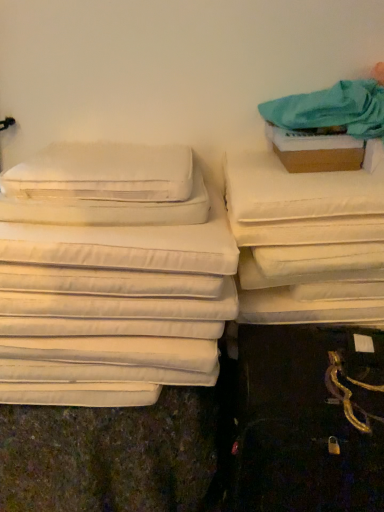
The height and width of the screenshot is (512, 384). What are the coordinates of `white soft pillow at left, the 1th pillow positioned from the bottom` in the screenshot? It's located at (108, 209).

The image size is (384, 512). What do you see at coordinates (298, 190) in the screenshot?
I see `white fabric cushion at upper right, the second sheet from the left` at bounding box center [298, 190].

The image size is (384, 512). Find the location of `white soft pillow at left, the 1th pillow positioned from the bottom`. white soft pillow at left, the 1th pillow positioned from the bottom is located at coordinates (108, 209).

Is teal fabric at upper right not close to brown cardboard box at upper right?

No, there isn't a large distance between teal fabric at upper right and brown cardboard box at upper right.

Which is correct: teal fabric at upper right is inside brown cardboard box at upper right, or outside of it?

teal fabric at upper right is located beyond the bounds of brown cardboard box at upper right.

Considering the sizes of teal fabric at upper right and brown cardboard box at upper right in the image, is teal fabric at upper right wider or thinner than brown cardboard box at upper right?

teal fabric at upper right is wider than brown cardboard box at upper right.

Is white soft fabric at center, the first sheet in the bottom-to-top sequence, not near teal fabric at upper right?

No, white soft fabric at center, the first sheet in the bottom-to-top sequence, is not far from teal fabric at upper right.

From the image's perspective, is white soft fabric at center, the first sheet in the left-to-right sequence, on teal fabric at upper right?

No.

Is teal fabric at upper right inside white soft fabric at center, the first sheet in the left-to-right sequence?

No, teal fabric at upper right is located outside of white soft fabric at center, the first sheet in the left-to-right sequence.

Between white fabric cushion at upper right, which is counted as the 1th sheet, starting from the top, and white soft fabric at center, the second sheet in the right-to-left sequence, which one has larger width?

white fabric cushion at upper right, which is counted as the 1th sheet, starting from the top.

Is white fabric cushion at upper right, the second sheet from the left, aimed at white soft fabric at center, which ranks as the second sheet in top-to-bottom order?

No, white fabric cushion at upper right, the second sheet from the left, is not facing towards white soft fabric at center, which ranks as the second sheet in top-to-bottom order.

Does white fabric cushion at upper right, the second sheet from the left, have a smaller size compared to white soft fabric at center, the second sheet in the right-to-left sequence?

Correct, white fabric cushion at upper right, the second sheet from the left, occupies less space than white soft fabric at center, the second sheet in the right-to-left sequence.

From a real-world perspective, between white fabric cushion at upper right, which ranks as the second sheet in bottom-to-top order, and white soft fabric at center, the second sheet in the right-to-left sequence, who is vertically higher?

From a 3D spatial view, white fabric cushion at upper right, which ranks as the second sheet in bottom-to-top order, is above.

From the image's perspective, does teal fabric at upper right appear lower than white fabric cushion at upper right, which ranks as the second sheet in bottom-to-top order?

Incorrect, from the image's perspective, teal fabric at upper right is higher than white fabric cushion at upper right, which ranks as the second sheet in bottom-to-top order.

Is teal fabric at upper right beside white fabric cushion at upper right, the second sheet from the left?

No.

In the image, is teal fabric at upper right positioned in front of or behind white fabric cushion at upper right, the 1th sheet viewed from the right?

teal fabric at upper right is in front of white fabric cushion at upper right, the 1th sheet viewed from the right.

Is white fabric mattress at right turned away from white fabric cushion at upper right, which is counted as the 1th sheet, starting from the top?

No, white fabric mattress at right's orientation is not away from white fabric cushion at upper right, which is counted as the 1th sheet, starting from the top.

Considering the positions of point (370, 264) and point (267, 195), is point (370, 264) closer or farther from the camera than point (267, 195)?

Point (370, 264).

Could you measure the distance between white fabric mattress at right and white fabric cushion at upper right, which ranks as the second sheet in bottom-to-top order?

white fabric mattress at right is 2.12 inches from white fabric cushion at upper right, which ranks as the second sheet in bottom-to-top order.

Looking at this image, in terms of height, does white fabric mattress at right look taller or shorter compared to white fabric cushion at upper right, the 1th sheet viewed from the right?

In the image, white fabric mattress at right appears to be taller than white fabric cushion at upper right, the 1th sheet viewed from the right.

From a real-world perspective, is white fabric mattress at right below brown cardboard box at upper right?

Yes, from a real-world perspective, white fabric mattress at right is beneath brown cardboard box at upper right.

Is white fabric mattress at right to the left of brown cardboard box at upper right from the viewer's perspective?

Incorrect, white fabric mattress at right is not on the left side of brown cardboard box at upper right.

Is white fabric mattress at right turned away from brown cardboard box at upper right?

No, white fabric mattress at right is not facing away from brown cardboard box at upper right.

Which point is more forward, (x=176, y=186) or (x=342, y=160)?

Point (x=176, y=186)

Would you consider white soft pillow at upper left, the 1th pillow viewed from the top, to be distant from brown cardboard box at upper right?

No, white soft pillow at upper left, the 1th pillow viewed from the top, is not far from brown cardboard box at upper right.

What's the angular difference between white soft pillow at upper left, the 1th pillow viewed from the top, and brown cardboard box at upper right's facing directions?

There is a 3.33-degree angle between the facing directions of white soft pillow at upper left, the 1th pillow viewed from the top, and brown cardboard box at upper right.

I want to click on cloth on the right side of brown cardboard box at upper right, so click(331, 111).

The width and height of the screenshot is (384, 512). I want to click on sheet in front of the teal fabric at upper right, so click(x=113, y=312).

Which object lies nearer to the anchor point white soft pillow at upper left, the 2th pillow positioned from the bottom, white soft pillow at left, the second pillow from the top, or brown cardboard box at upper right?

white soft pillow at left, the second pillow from the top, is positioned closer to the anchor white soft pillow at upper left, the 2th pillow positioned from the bottom.

Estimate the real-world distances between objects in this image. Which object is further from brown cardboard box at upper right, white soft pillow at upper left, the 1th pillow viewed from the top, or white fabric mattress at right?

Based on the image, white soft pillow at upper left, the 1th pillow viewed from the top, appears to be further to brown cardboard box at upper right.

From the image, which object appears to be nearer to teal fabric at upper right, brown cardboard box at upper right or white soft fabric at center, the first sheet in the left-to-right sequence?

The object closer to teal fabric at upper right is brown cardboard box at upper right.

Estimate the real-world distances between objects in this image. Which object is further from brown cardboard box at upper right, white fabric mattress at right or white soft fabric at center, the first sheet in the left-to-right sequence?

white soft fabric at center, the first sheet in the left-to-right sequence, lies further to brown cardboard box at upper right than the other object.

When comparing their distances from brown cardboard box at upper right, does white soft pillow at upper left, the 1th pillow viewed from the top, or white soft fabric at center, which ranks as the second sheet in top-to-bottom order, seem further?

white soft fabric at center, which ranks as the second sheet in top-to-bottom order, is positioned further to the anchor brown cardboard box at upper right.

From the picture: Based on their spatial positions, is brown cardboard box at upper right or white soft pillow at upper left, the 1th pillow viewed from the top, closer to white fabric cushion at upper right, the second sheet from the left?

Based on the image, brown cardboard box at upper right appears to be nearer to white fabric cushion at upper right, the second sheet from the left.

From the image, which object appears to be nearer to white soft fabric at center, the second sheet in the right-to-left sequence, white soft pillow at left, the 1th pillow positioned from the bottom, or white fabric cushion at upper right, the 1th sheet viewed from the right?

white soft pillow at left, the 1th pillow positioned from the bottom.

When comparing their distances from white soft fabric at center, the first sheet in the bottom-to-top sequence, does white soft pillow at left, the 1th pillow positioned from the bottom, or white fabric mattress at right seem closer?

white soft pillow at left, the 1th pillow positioned from the bottom, is closer to white soft fabric at center, the first sheet in the bottom-to-top sequence.

Identify the location of sheet located between white soft fabric at center, the first sheet in the bottom-to-top sequence, and white fabric mattress at right in the left-right direction. 298,190.

This screenshot has width=384, height=512. I want to click on furniture situated between white soft pillow at left, the second pillow from the top, and teal fabric at upper right from left to right, so [x=306, y=237].

Image resolution: width=384 pixels, height=512 pixels. Find the location of `cardboard box situated between white soft pillow at left, the 1th pillow positioned from the bottom, and white fabric mattress at right from left to right`. cardboard box situated between white soft pillow at left, the 1th pillow positioned from the bottom, and white fabric mattress at right from left to right is located at coordinates (316, 150).

Identify the location of furniture situated between white soft fabric at center, the second sheet in the right-to-left sequence, and teal fabric at upper right from left to right. Image resolution: width=384 pixels, height=512 pixels. (306, 237).